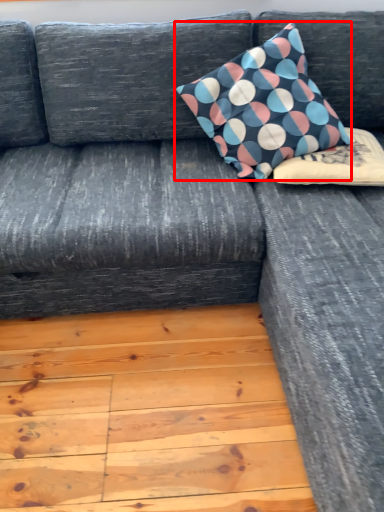
Question: From the image's perspective, what is the correct spatial relationship of pillow (annotated by the red box) in relation to pillow?

Choices:
 (A) above
 (B) below

Answer: (A)